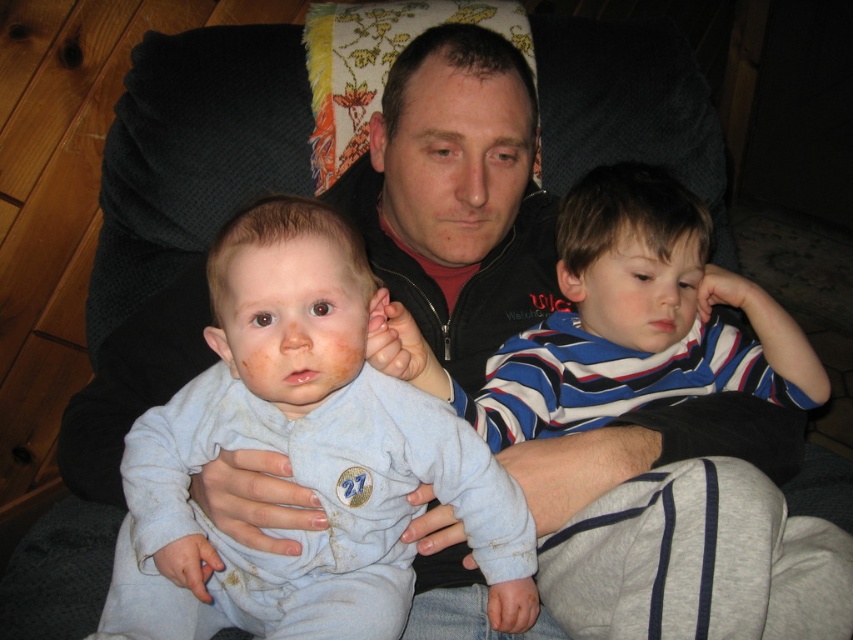
Question: Is striped cotton shirt at center positioned at the back of light blue soft fabric baby at center?

Choices:
 (A) yes
 (B) no

Answer: (B)

Question: Which object is farther from the camera taking this photo?

Choices:
 (A) striped cotton shirt at center
 (B) light blue soft fabric baby at center

Answer: (B)

Question: Which point is farther to the camera?

Choices:
 (A) [x=387, y=445]
 (B) [x=688, y=477]

Answer: (A)

Question: Can you confirm if striped cotton shirt at center is positioned above light blue soft fabric baby at center?

Choices:
 (A) yes
 (B) no

Answer: (A)

Question: Does striped cotton shirt at center appear under light blue soft fabric baby at center?

Choices:
 (A) yes
 (B) no

Answer: (B)